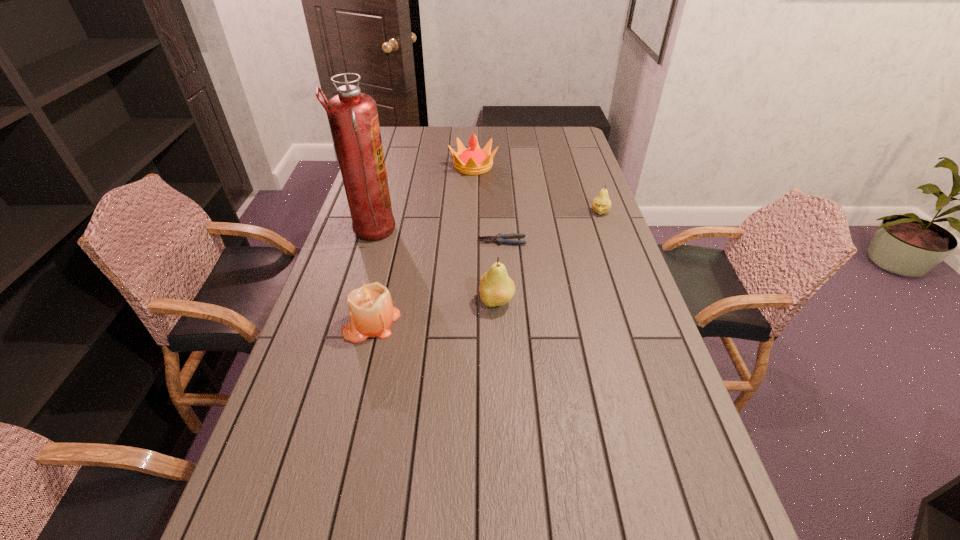
Given the evenly spaced pears in the image, where should an extra pear be added on the left to preserve the spacing? Please point to a vacant space. Please provide its 2D coordinates. Your answer should be formatted as a tuple, i.e. [(x, y)], where the tuple contains the x and y coordinates of a point satisfying the conditions above.

[(317, 459)]